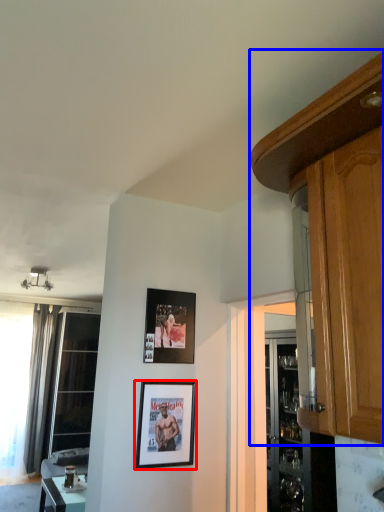
Question: Which point is further to the camera, picture frame (highlighted by a red box) or cabinetry (highlighted by a blue box)?

Choices:
 (A) picture frame
 (B) cabinetry

Answer: (A)